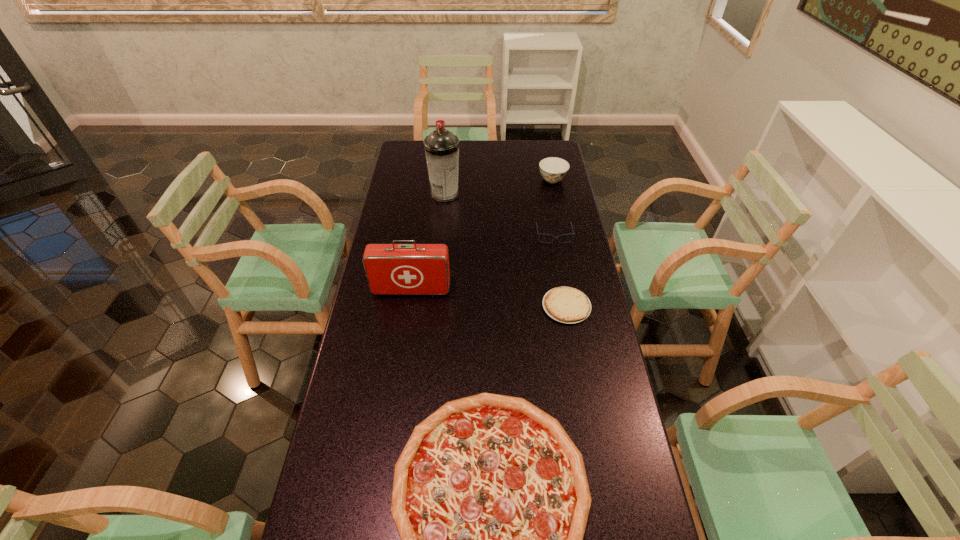
Find the location of a particular element. free spot between the first-aid kit and the aerosol can is located at coordinates (428, 242).

This screenshot has width=960, height=540. What are the coordinates of `blank region between the tallest object and the spectacles` in the screenshot? It's located at (499, 215).

The width and height of the screenshot is (960, 540). What are the coordinates of `free point between the aerosol can and the fifth shortest object` in the screenshot? It's located at (428, 242).

Locate an element on the screen. free point between the tortilla and the tallest object is located at coordinates (506, 250).

Identify the location of free area in between the spectacles and the aerosol can. The width and height of the screenshot is (960, 540). (499, 215).

The width and height of the screenshot is (960, 540). Identify the location of the fifth closest object relative to the spectacles. (490, 497).

Identify which object is the third nearest to the spectacles. Please provide its 2D coordinates. Your answer should be formatted as a tuple, i.e. [(x, y)], where the tuple contains the x and y coordinates of a point satisfying the conditions above.

[(441, 146)]

Find the location of a particular element. free space that satisfies the following two spatial constraints: 1. on the front-facing side of the spectacles; 2. on the right side of the tortilla is located at coordinates (566, 306).